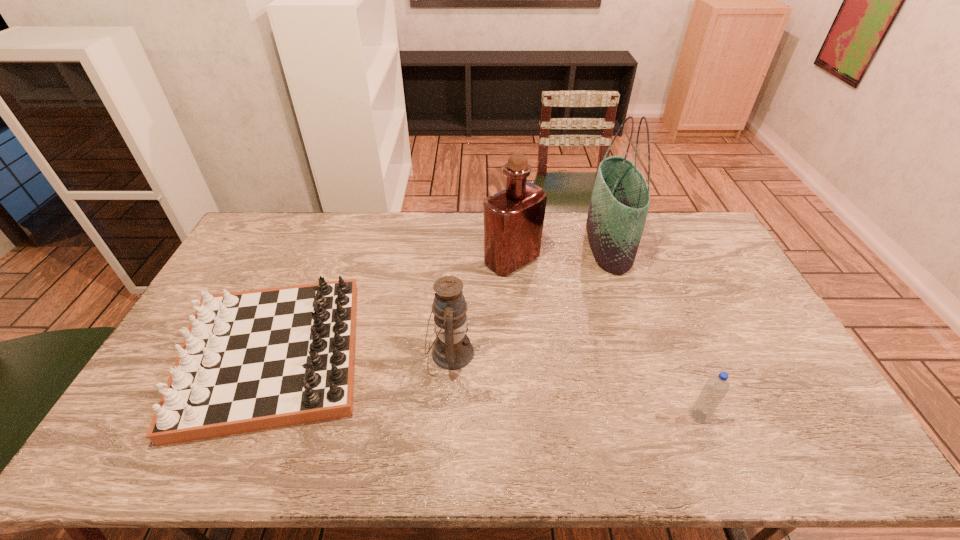
Find the location of a particular element. free spot located on the back of the third tallest object is located at coordinates (457, 249).

Where is `vacant space located on the left of the water bottle`? This screenshot has height=540, width=960. vacant space located on the left of the water bottle is located at coordinates (623, 416).

This screenshot has width=960, height=540. Find the location of `vacant space situated on the right of the gameboard`. vacant space situated on the right of the gameboard is located at coordinates (406, 356).

At what (x,y) coordinates should I click in order to perform the action: click on tote bag located in the far edge section of the desktop. Please return your answer as a coordinate pair (x, y). Looking at the image, I should click on (620, 200).

This screenshot has height=540, width=960. Find the location of `liquor located at the far edge`. liquor located at the far edge is located at coordinates (x=513, y=218).

Where is `object present at the near edge`? Image resolution: width=960 pixels, height=540 pixels. object present at the near edge is located at coordinates (254, 360).

In order to click on object that is positioned at the left edge in this screenshot , I will do `click(254, 360)`.

Image resolution: width=960 pixels, height=540 pixels. In order to click on object located at the near left corner in this screenshot , I will do `click(254, 360)`.

The image size is (960, 540). What are the coordinates of `blank space at the far edge of the desktop` in the screenshot? It's located at (348, 241).

Identify the location of vacant region at the near edge of the desktop. This screenshot has width=960, height=540. (583, 434).